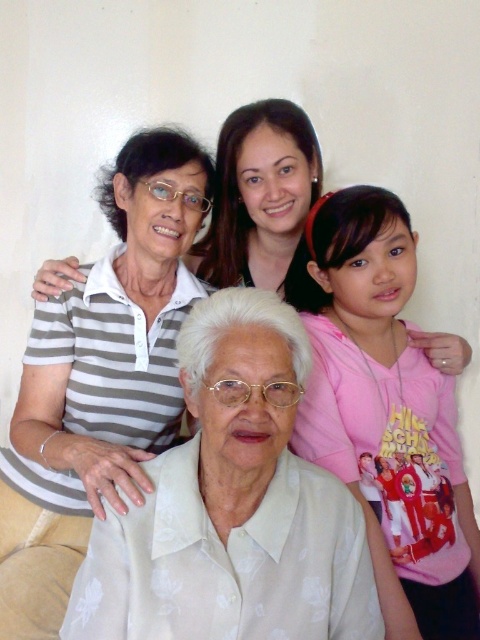
Question: Which of the following is the farthest from the observer?

Choices:
 (A) gray striped shirt at upper left
 (B) pink cotton shirt at upper right

Answer: (B)

Question: Is gray striped shirt at upper left to the right of pink cotton shirt at upper right from the viewer's perspective?

Choices:
 (A) yes
 (B) no

Answer: (B)

Question: Can you confirm if gray striped shirt at upper left is positioned below pink cotton shirt at upper right?

Choices:
 (A) no
 (B) yes

Answer: (A)

Question: Among these points, which one is farthest from the camera?

Choices:
 (A) (382, 352)
 (B) (12, 419)

Answer: (B)

Question: Which point is closer to the camera taking this photo?

Choices:
 (A) (384, 333)
 (B) (151, 256)

Answer: (A)

Question: Does gray striped shirt at upper left lie behind pink cotton shirt at upper right?

Choices:
 (A) yes
 (B) no

Answer: (B)